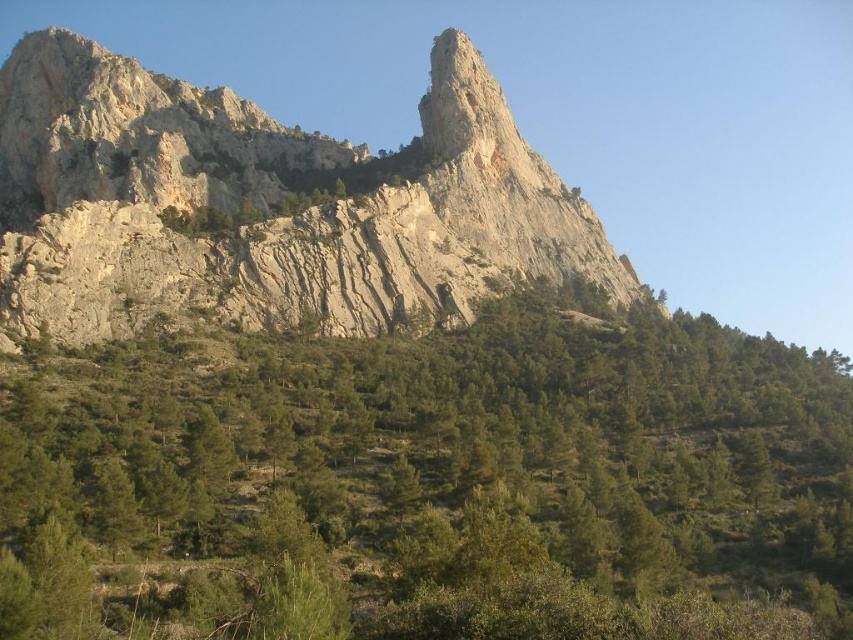
Question: Is the position of green leafy trees at lower center less distant than that of rugged stone mountain at center?

Choices:
 (A) yes
 (B) no

Answer: (A)

Question: Where is green leafy trees at lower center located in relation to rugged stone mountain at center in the image?

Choices:
 (A) below
 (B) above

Answer: (A)

Question: Does green leafy trees at lower center have a larger size compared to rugged stone mountain at center?

Choices:
 (A) yes
 (B) no

Answer: (B)

Question: Which point is farther from the camera taking this photo?

Choices:
 (A) (254, 172)
 (B) (26, 365)

Answer: (A)

Question: Which of the following is the closest to the observer?

Choices:
 (A) green leafy trees at lower center
 (B) rugged stone mountain at center

Answer: (A)

Question: Which point is farther from the camera taking this photo?

Choices:
 (A) (526, 227)
 (B) (334, 449)

Answer: (A)